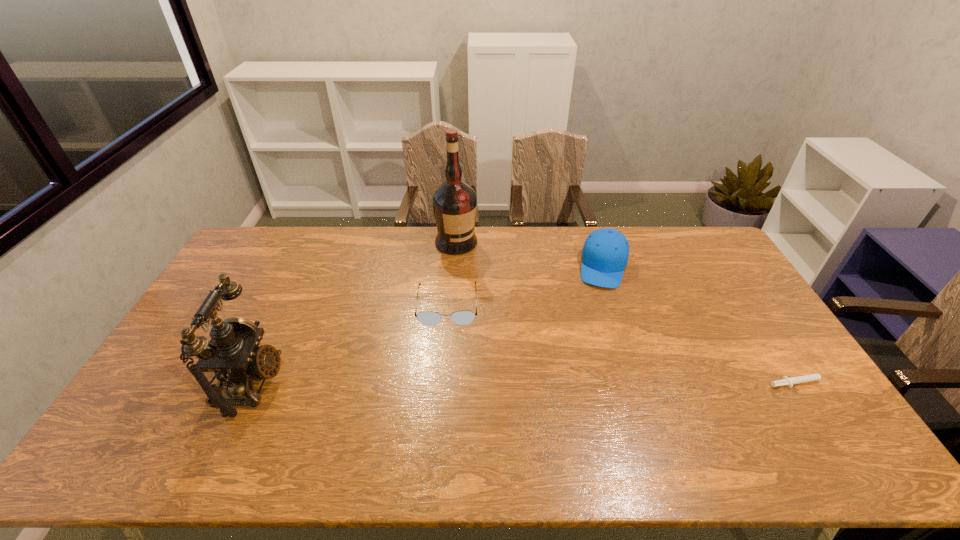
Image resolution: width=960 pixels, height=540 pixels. I want to click on free location located 0.050m on the surface of the liquor, so click(x=473, y=261).

The width and height of the screenshot is (960, 540). Find the location of `blank area located 0.380m on the surface of the liquor`. blank area located 0.380m on the surface of the liquor is located at coordinates (524, 318).

This screenshot has width=960, height=540. What are the coordinates of `free location located 0.090m on the surface of the liquor` in the screenshot? It's located at point(479,267).

I want to click on vacant area situated 0.140m on the front-facing side of the third tallest object, so click(x=598, y=318).

The image size is (960, 540). I want to click on vacant space located on the front-facing side of the third tallest object, so click(597, 322).

Locate an element on the screen. Image resolution: width=960 pixels, height=540 pixels. vacant space located on the front-facing side of the third tallest object is located at coordinates (589, 368).

Identify the location of vacant space situated 0.310m on the lenses of the fourth tallest object. (443, 416).

Where is `vacant region located 0.060m on the lenses of the fourth tallest object`? vacant region located 0.060m on the lenses of the fourth tallest object is located at coordinates (446, 342).

Image resolution: width=960 pixels, height=540 pixels. What are the coordinates of `vacant space located on the lenses of the fourth tallest object` in the screenshot? It's located at (445, 363).

Locate an element on the screen. liquor that is at the far edge is located at coordinates (454, 202).